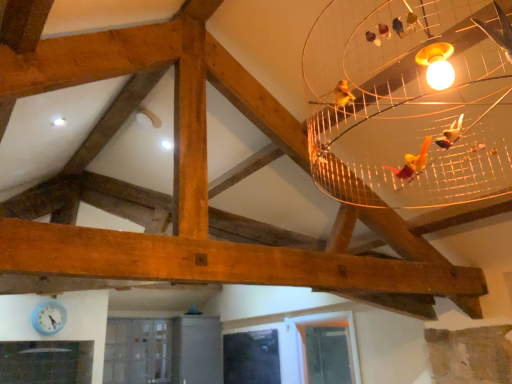
Question: Is light blue plastic clock at lower left next to clear glass window at lower center, arranged as the second window when viewed from the back, and touching it?

Choices:
 (A) no
 (B) yes

Answer: (A)

Question: Is clear glass window at lower center, the first window when ordered from front to back, completely or partially inside light blue plastic clock at lower left?

Choices:
 (A) no
 (B) yes

Answer: (A)

Question: From the image's perspective, does light blue plastic clock at lower left appear higher than clear glass window at lower center, marked as the 1th window in a right-to-left arrangement?

Choices:
 (A) no
 (B) yes

Answer: (B)

Question: Does light blue plastic clock at lower left have a lesser width compared to clear glass window at lower center, marked as the 1th window in a right-to-left arrangement?

Choices:
 (A) yes
 (B) no

Answer: (A)

Question: Is light blue plastic clock at lower left not inside clear glass window at lower center, which is counted as the 2th window, starting from the left?

Choices:
 (A) yes
 (B) no

Answer: (A)

Question: Is light blue plastic clock at lower left positioned behind clear glass window at lower center, which is counted as the 2th window, starting from the left?

Choices:
 (A) no
 (B) yes

Answer: (B)

Question: Does transparent glass window at lower center, which appears as the first window when viewed from the back, lie in front of clear glass window at lower center, marked as the 1th window in a right-to-left arrangement?

Choices:
 (A) no
 (B) yes

Answer: (A)

Question: Considering the relative positions of transparent glass window at lower center, which appears as the first window when viewed from the back, and clear glass window at lower center, which is counted as the 2th window, starting from the left, in the image provided, is transparent glass window at lower center, which appears as the first window when viewed from the back, to the left of clear glass window at lower center, which is counted as the 2th window, starting from the left, from the viewer's perspective?

Choices:
 (A) no
 (B) yes

Answer: (B)

Question: Is transparent glass window at lower center, which appears as the first window when viewed from the back, wider than clear glass window at lower center, which is counted as the 2th window, starting from the left?

Choices:
 (A) no
 (B) yes

Answer: (A)

Question: Is transparent glass window at lower center, which appears as the 2th window when viewed from the right, turned away from clear glass window at lower center, the first window when ordered from front to back?

Choices:
 (A) yes
 (B) no

Answer: (B)

Question: Is transparent glass window at lower center, which is the 1th window from left to right, bigger than clear glass window at lower center, arranged as the second window when viewed from the back?

Choices:
 (A) yes
 (B) no

Answer: (B)

Question: From a real-world perspective, is transparent glass window at lower center, which appears as the 2th window when viewed from the right, below clear glass window at lower center, the first window when ordered from front to back?

Choices:
 (A) no
 (B) yes

Answer: (B)

Question: Is the depth of transparent glass window at lower center, which appears as the first window when viewed from the back, greater than that of light blue plastic clock at lower left?

Choices:
 (A) no
 (B) yes

Answer: (B)